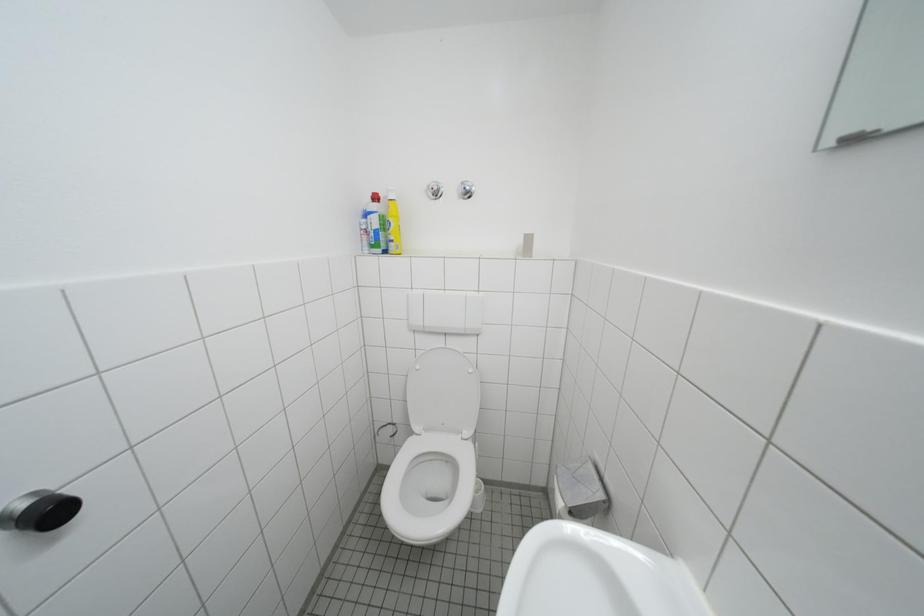
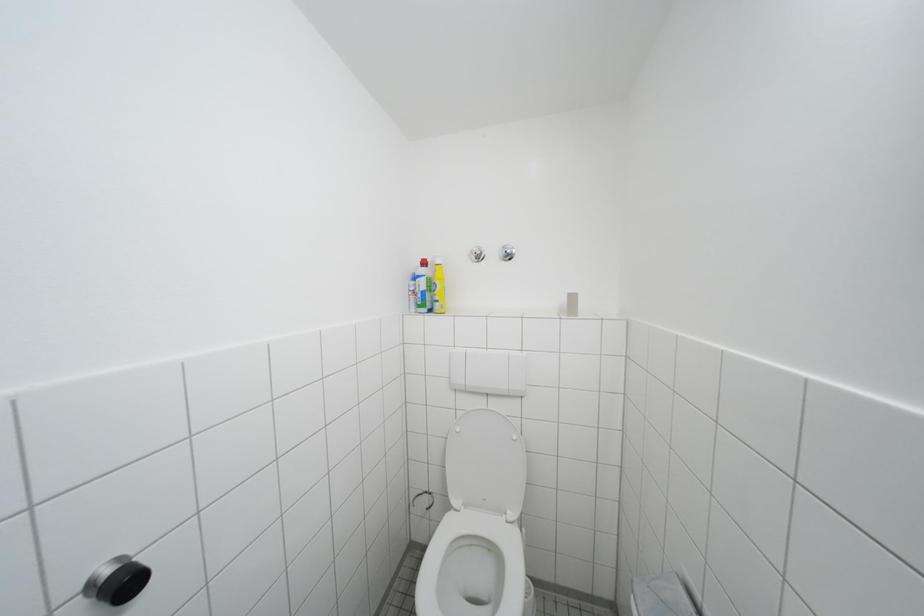
The images are taken continuously from a first-person perspective. In which direction are you moving?

The movement direction of the cameraman is left, backward.